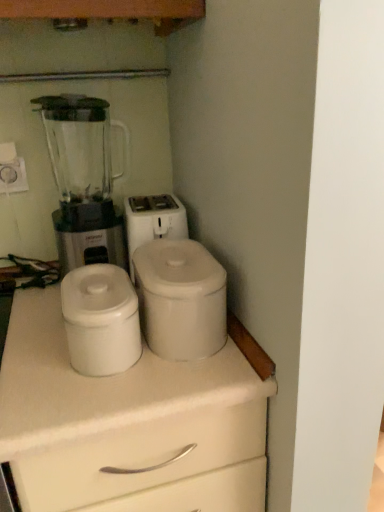
This screenshot has height=512, width=384. Identify the location of free spot to the left of white matte canister at center, arranged as the 1th appliance when viewed from the right. (45, 344).